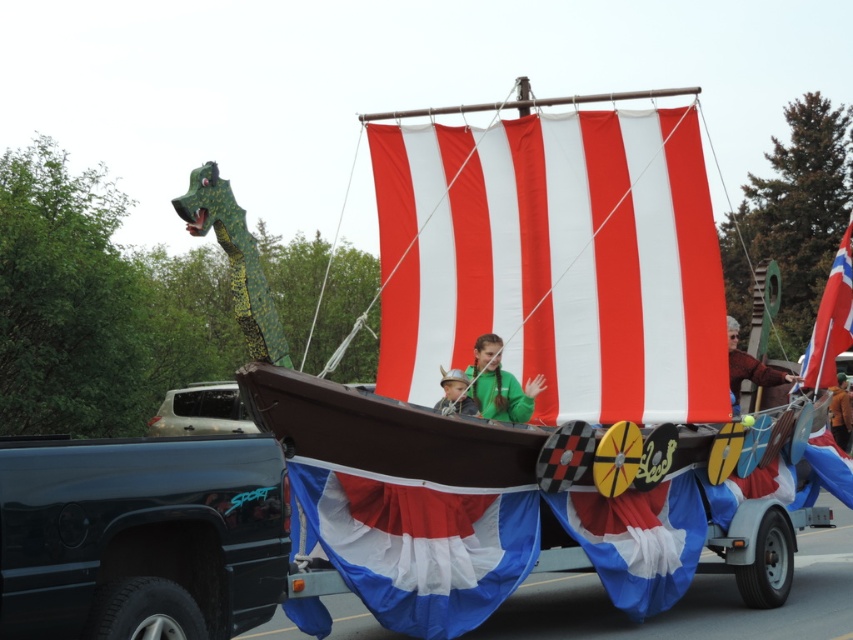
Question: Is black glossy truck at lower left below brown leather jacket at upper right?

Choices:
 (A) yes
 (B) no

Answer: (A)

Question: Which point is farther to the camera?

Choices:
 (A) (465, 384)
 (B) (250, 348)
 (C) (585, 531)

Answer: (A)

Question: Which point appears farthest from the camera in this image?

Choices:
 (A) (547, 355)
 (B) (252, 353)
 (C) (55, 561)
 (D) (491, 394)

Answer: (A)

Question: Is green matte jacket at center further to camera compared to brown leather jacket at upper right?

Choices:
 (A) no
 (B) yes

Answer: (A)

Question: In this image, where is green matte jacket at center located relative to brown leather jacket at upper right?

Choices:
 (A) below
 (B) above

Answer: (B)

Question: Which object appears closest to the camera in this image?

Choices:
 (A) black glossy truck at lower left
 (B) red fabric flag at right
 (C) green metallic dragon head at upper left
 (D) blue fabric sail at center

Answer: (A)